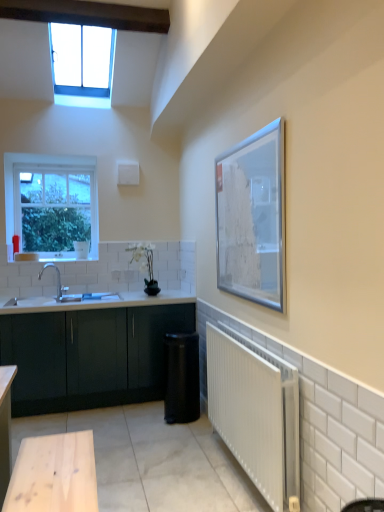
Question: Does silver metallic picture frame at upper right have a lesser width compared to white metallic radiator at lower right?

Choices:
 (A) no
 (B) yes

Answer: (B)

Question: Is silver metallic picture frame at upper right bigger than white metallic radiator at lower right?

Choices:
 (A) yes
 (B) no

Answer: (B)

Question: Can you confirm if silver metallic picture frame at upper right is smaller than white metallic radiator at lower right?

Choices:
 (A) no
 (B) yes

Answer: (B)

Question: Considering the relative sizes of silver metallic picture frame at upper right and white metallic radiator at lower right in the image provided, is silver metallic picture frame at upper right taller than white metallic radiator at lower right?

Choices:
 (A) yes
 (B) no

Answer: (A)

Question: Is silver metallic picture frame at upper right next to white metallic radiator at lower right and touching it?

Choices:
 (A) no
 (B) yes

Answer: (A)

Question: Is clear glass window at upper left, which is counted as the second window, starting from the front, wider or thinner than white glossy sink at lower left?

Choices:
 (A) thin
 (B) wide

Answer: (A)

Question: From the image's perspective, is clear glass window at upper left, which is counted as the second window, starting from the front, positioned above or below white glossy sink at lower left?

Choices:
 (A) above
 (B) below

Answer: (A)

Question: From their relative heights in the image, would you say clear glass window at upper left, which is counted as the second window, starting from the front, is taller or shorter than white glossy sink at lower left?

Choices:
 (A) tall
 (B) short

Answer: (A)

Question: In the image, is clear glass window at upper left, the 1th window viewed from the back, positioned in front of or behind white glossy sink at lower left?

Choices:
 (A) front
 (B) behind

Answer: (B)

Question: Would you say silver metallic picture frame at upper right is inside or outside white metallic radiator at lower right?

Choices:
 (A) outside
 (B) inside

Answer: (A)

Question: Is point 279,176 closer or farther from the camera than point 228,394?

Choices:
 (A) closer
 (B) farther

Answer: (A)

Question: Based on their positions, is silver metallic picture frame at upper right located to the left or right of white metallic radiator at lower right?

Choices:
 (A) right
 (B) left

Answer: (A)

Question: From their relative heights in the image, would you say silver metallic picture frame at upper right is taller or shorter than white metallic radiator at lower right?

Choices:
 (A) short
 (B) tall

Answer: (B)

Question: From the image's perspective, is silver metallic picture frame at upper right above or below matte dark green cabinet at lower left?

Choices:
 (A) above
 (B) below

Answer: (A)

Question: Is point (279, 126) positioned closer to the camera than point (153, 374)?

Choices:
 (A) closer
 (B) farther

Answer: (A)